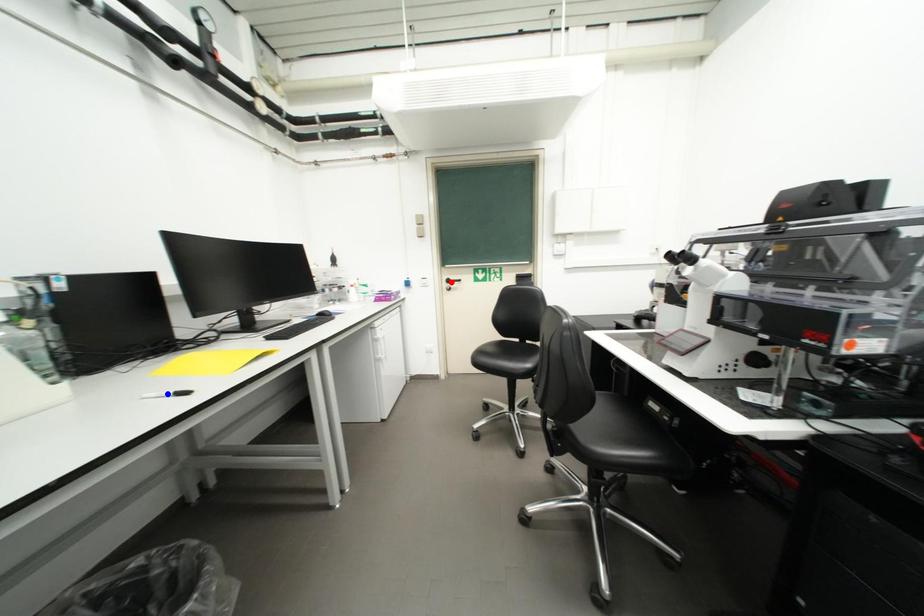
Question: Two points are marked on the image. Which point is closer to the camera?

Choices:
 (A) Blue point is closer.
 (B) Red point is closer.

Answer: (A)